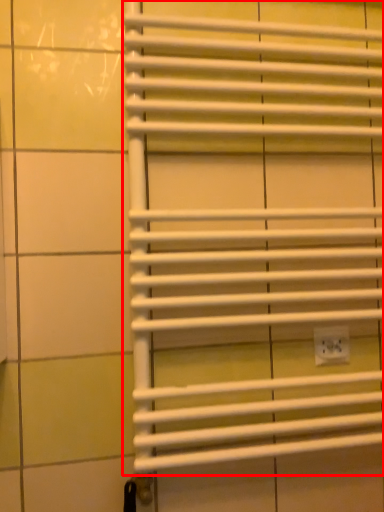
Question: From the image's perspective, where is window blind (annotated by the red box) located relative to electric outlet?

Choices:
 (A) above
 (B) below

Answer: (A)